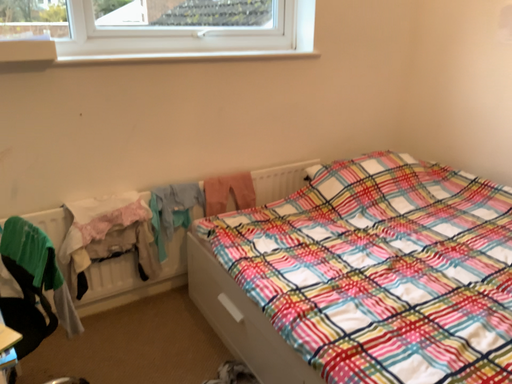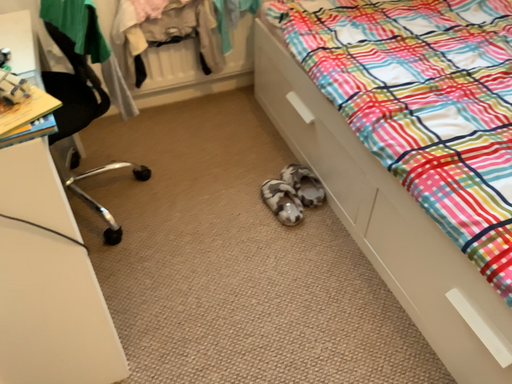
Question: Which way did the camera rotate in the video?

Choices:
 (A) rotated upward
 (B) rotated downward

Answer: (B)